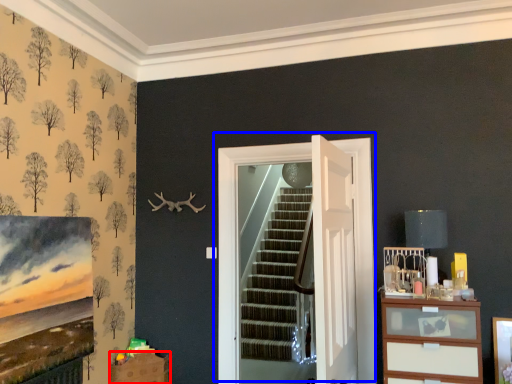
Question: Which of the following is the farthest to the observer, drawer (highlighted by a red box) or door (highlighted by a blue box)?

Choices:
 (A) drawer
 (B) door

Answer: (A)